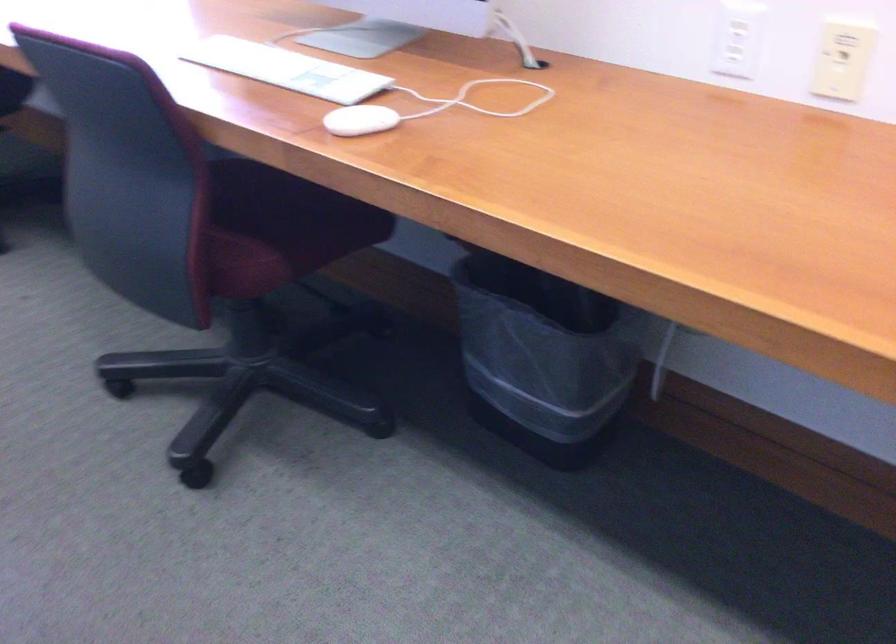
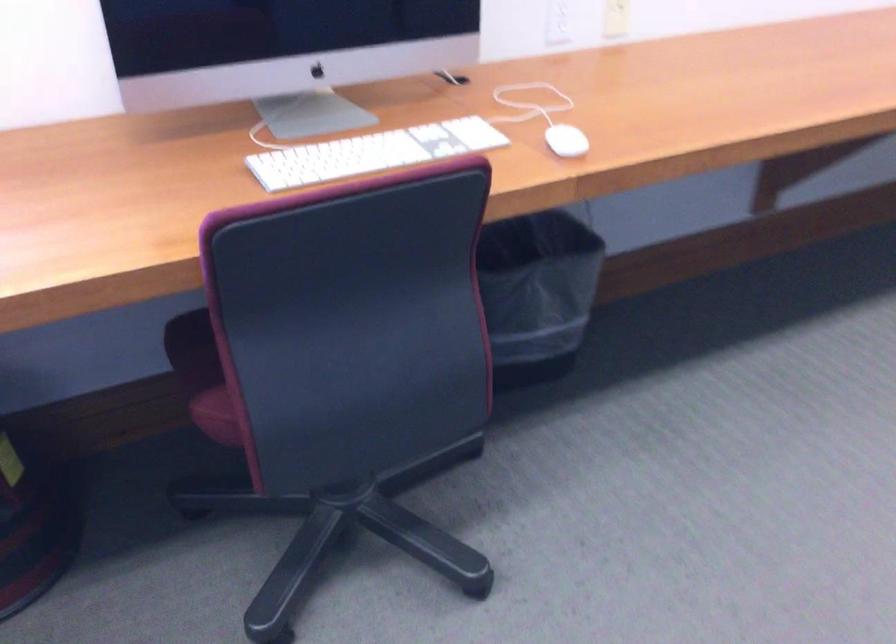
Question: I am providing you with two images of the same scene from different viewpoints. Please identify which objects are invisible in image2.

Choices:
 (A) chair sitting surface
 (B) white computer keyboard
 (C) black trash can
 (D) none of these

Answer: (D)